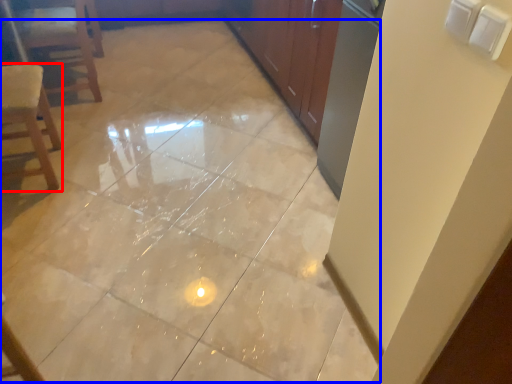
Question: Which object appears farthest to the camera in this image, chair (highlighted by a red box) or ceramic tile (highlighted by a blue box)?

Choices:
 (A) chair
 (B) ceramic tile

Answer: (A)